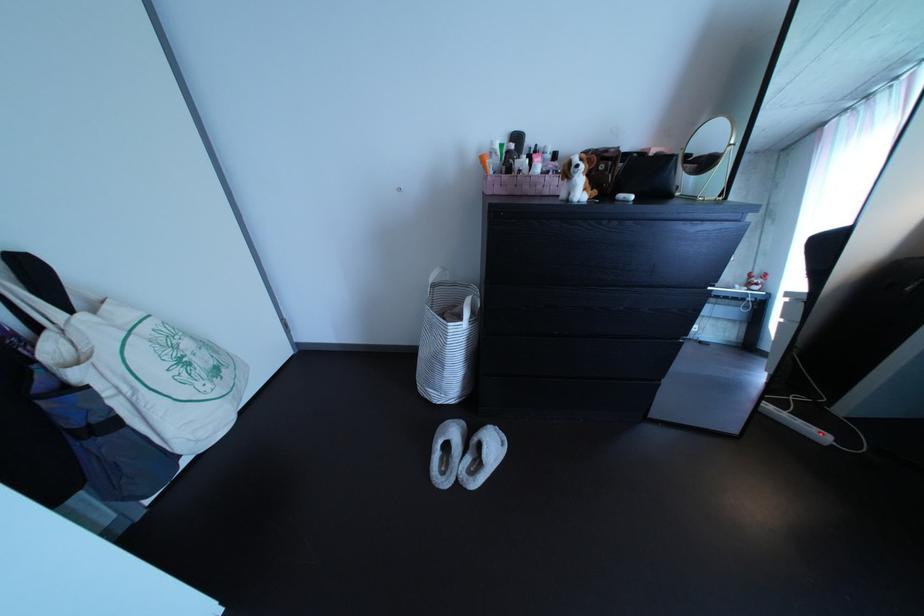
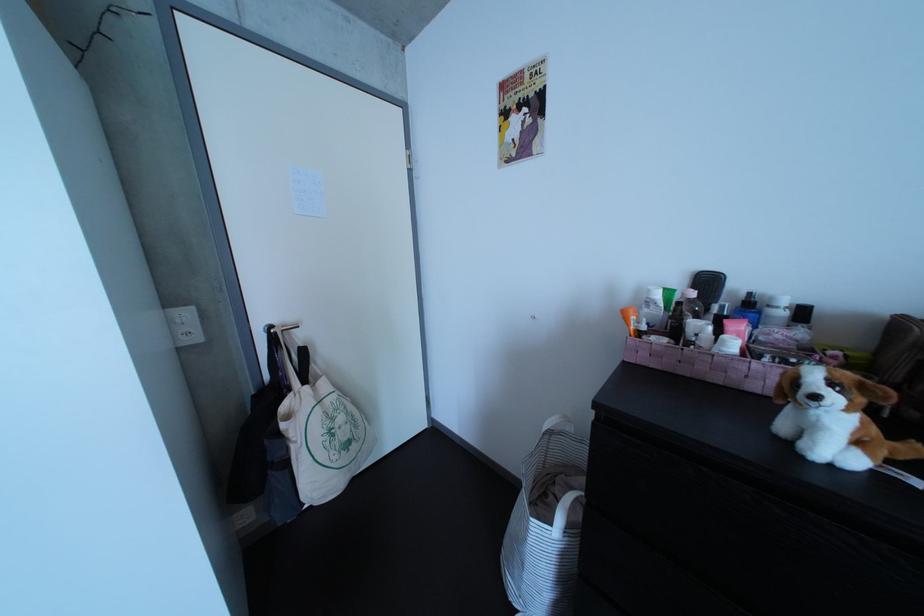
Question: The camera is either moving clockwise (left) or counter-clockwise (right) around the object. The first image is from the beginning of the video and the second image is from the end. Is the camera moving left or right when shooting the video?

Choices:
 (A) Left
 (B) Right

Answer: (B)